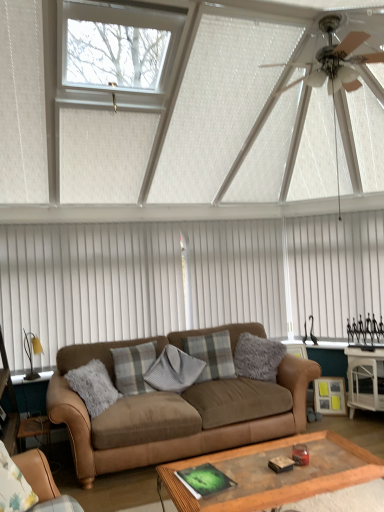
Question: From the image's perspective, relative to metallic silver ceiling fan at upper right, is white glossy side table at lower right above or below?

Choices:
 (A) below
 (B) above

Answer: (A)

Question: Looking at the image, does white glossy side table at lower right seem bigger or smaller compared to metallic silver ceiling fan at upper right?

Choices:
 (A) big
 (B) small

Answer: (B)

Question: Which object is the closest to the plush gray pillow at center, the second pillow in the left-to-right sequence?

Choices:
 (A) fuzzy gray pillow at center, which ranks as the 1th pillow in right-to-left order
 (B) white vertical blinds at center
 (C) plaid fabric pillow at center, which is the 3th pillow in left-to-right order
 (D) brown leather couch at center, acting as the 2th studio couch starting from the front
 (E) metallic silver ceiling fan at upper right

Answer: (C)

Question: Based on their relative distances, which object is nearer to the brown leather couch at center, acting as the 2th studio couch starting from the front?

Choices:
 (A) brown leather couch at lower left, which ranks as the 2th studio couch in back-to-front order
 (B) white vertical blinds at upper center
 (C) plush gray pillow at center, the second pillow in the left-to-right sequence
 (D) plaid fabric pillow at center, which appears as the 4th pillow when viewed from the right
 (E) metallic silver ceiling fan at upper right

Answer: (C)